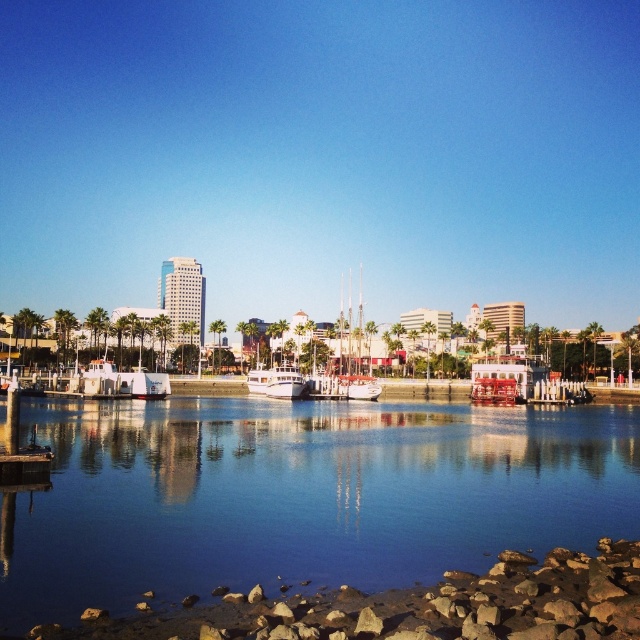
You are standing at the point with coordinates (358,365) in the image. What object are you directly facing?

The point at coordinates (358,365) corresponds to the white glossy sailboat at center, so you are directly facing the white glossy sailboat at center.

You are standing on the pier and want to take a photo of the white glossy boat at center and the clear water at center. Which object should you focus on first if you want to capture both in a single frame without moving your camera?

You should focus on the clear water at center first because it is larger in size than the white glossy boat at center, making it easier to frame both objects in the shot.

You are standing at the edge of the waterfront and see the point marked at coordinates (301, 493). Based on the scene description, what is located at that point?

The point at coordinates (301, 493) marks clear water at center.